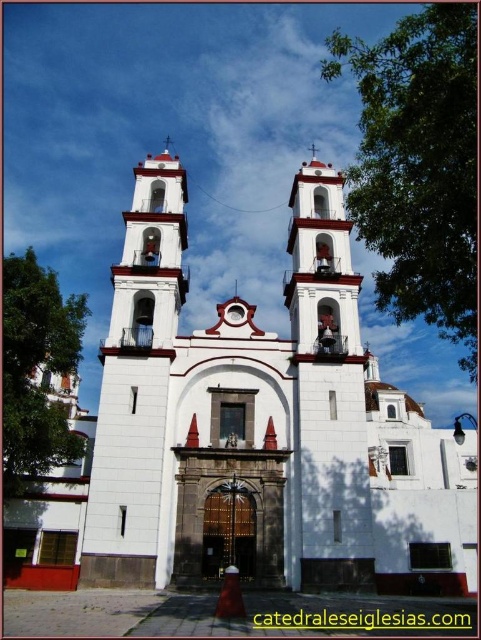
You are standing in front of the church and notice two points marked on its facade. The first point is at coordinates point (x=161, y=442) and the second is at point (x=341, y=268). Which point is closer to you?

Point (x=161, y=442) is closer to the viewer than point (x=341, y=268).

You are an architect visiting the church and want to determine which structure is taller between the white stucco church at center and the white stucco bell tower at center. Based on the scene, which one is taller?

The white stucco church at center is much taller than the white stucco bell tower at center.